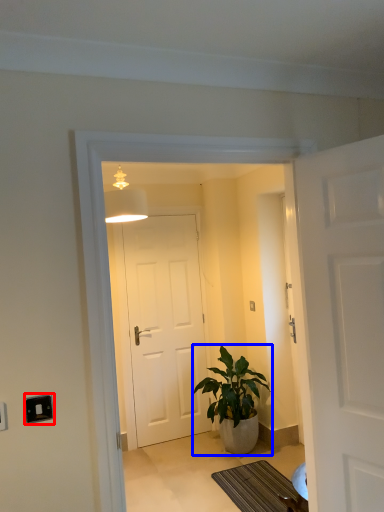
Question: Which point is further to the camera, electric outlet (highlighted by a red box) or houseplant (highlighted by a blue box)?

Choices:
 (A) electric outlet
 (B) houseplant

Answer: (B)